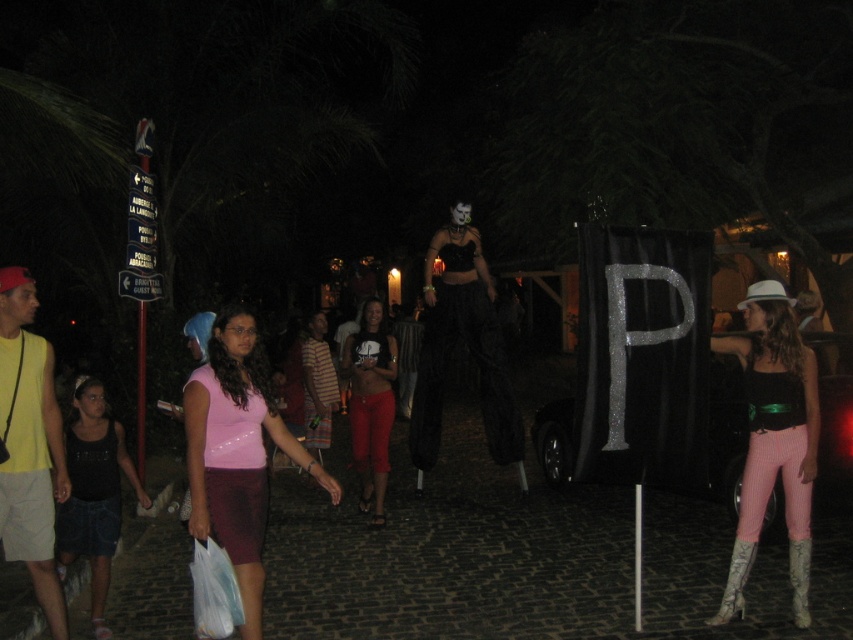
You are a GUI agent. You are given a task and a screenshot of the screen. Output one action in this format:
    pyautogui.click(x=<x>, y=<y>)
    Task: Click on the white leather boot at lower right
    Image resolution: width=853 pixels, height=640 pixels.
    Given the screenshot: What is the action you would take?
    pyautogui.click(x=735, y=582)

Which is more to the right, white leather boot at lower right or leather high-heeled boot at lower right?

Positioned to the right is leather high-heeled boot at lower right.

Where is `white leather boot at lower right`? This screenshot has height=640, width=853. white leather boot at lower right is located at coordinates (735, 582).

This screenshot has width=853, height=640. Identify the location of white leather boot at lower right. (735, 582).

Is pink glossy skirt at center positioned in front of white leather boot at lower right?

Yes.

Between point (252, 492) and point (741, 564), which one is positioned behind?

Point (741, 564)

This screenshot has width=853, height=640. In order to click on pink glossy skirt at center in this screenshot , I will do `click(236, 451)`.

Based on the photo, is yellow sleeveless shirt at left below striped fabric shirt at center?

Correct, yellow sleeveless shirt at left is located below striped fabric shirt at center.

Does yellow sleeveless shirt at left appear over striped fabric shirt at center?

Incorrect, yellow sleeveless shirt at left is not positioned above striped fabric shirt at center.

Between point (10, 442) and point (312, 339), which one is positioned in front?

Point (10, 442)

Where is `yellow sleeveless shirt at left`? yellow sleeveless shirt at left is located at coordinates (28, 444).